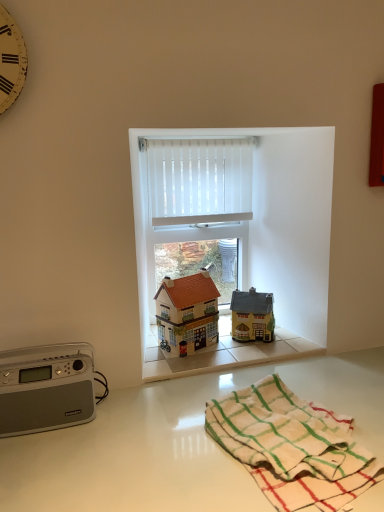
This screenshot has height=512, width=384. What are the coordinates of `free point behind white cotton towel at lower right` in the screenshot? It's located at (301, 376).